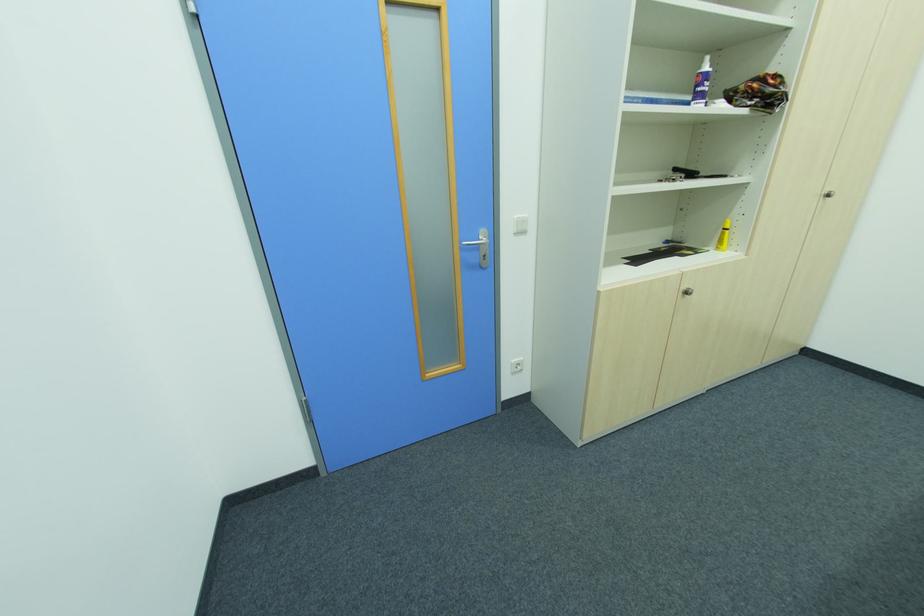
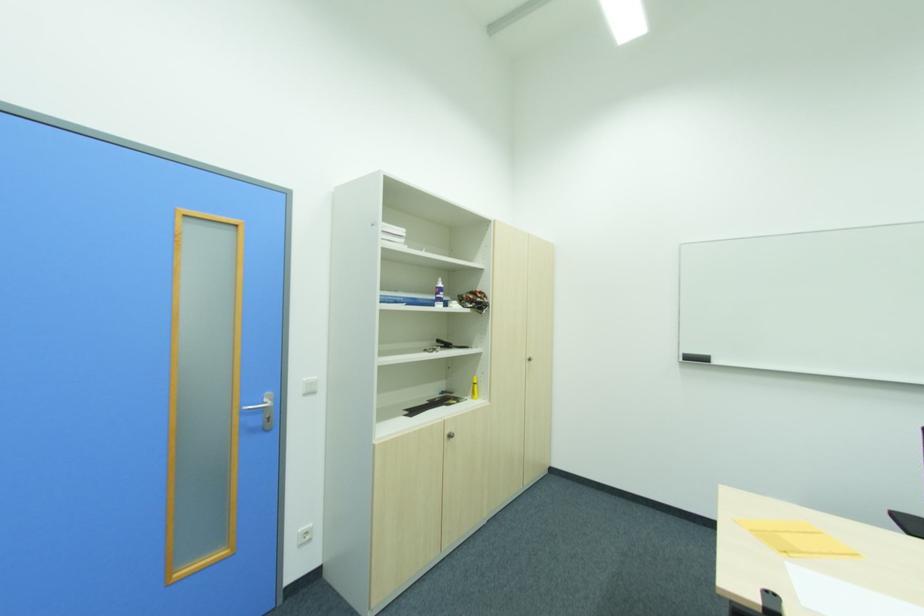
First-person continuous shooting, in which direction is the camera rotating?

The rotation direction of the camera is right-up.